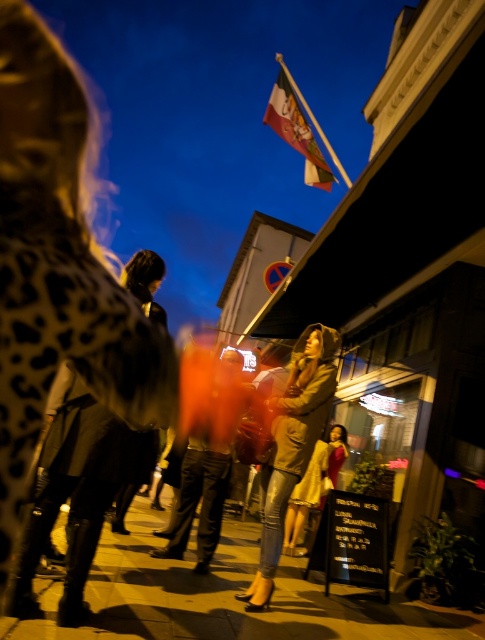
Does leopard print coat at center have a lesser width compared to leather jacket at center?

Correct, leopard print coat at center's width is less than leather jacket at center's.

Can you confirm if leopard print coat at center is taller than leather jacket at center?

No.

What are the coordinates of `leopard print coat at center` in the screenshot? It's located at (59, 262).

Is smooth concrete pavement at center wider than leather jacket at center?

Indeed, smooth concrete pavement at center has a greater width compared to leather jacket at center.

Who is positioned more to the right, smooth concrete pavement at center or leather jacket at center?

Positioned to the right is leather jacket at center.

Who is more forward, (167,586) or (313,387)?

Point (167,586) is more forward.

Identify the location of smooth concrete pavement at center. (221, 598).

Measure the distance between leopard print coat at center and camera.

A distance of 34.92 inches exists between leopard print coat at center and camera.

Does leopard print coat at center come behind smooth concrete pavement at center?

No, it is not.

Between point (16, 156) and point (390, 618), which one is positioned behind?

Positioned behind is point (390, 618).

At what (x,y) coordinates should I click in order to perform the action: click on leopard print coat at center. Please return your answer as a coordinate pair (x, y). Image resolution: width=485 pixels, height=640 pixels. Looking at the image, I should click on (59, 262).